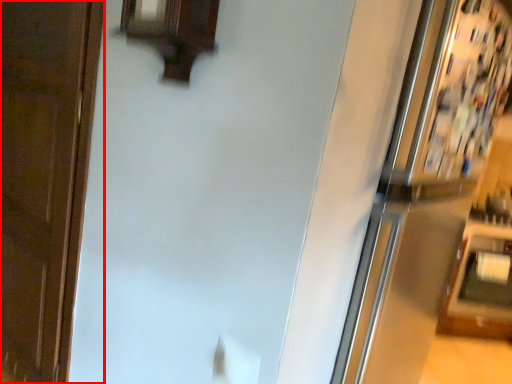
Question: From the image, what is the correct spatial relationship of door (annotated by the red box) in relation to fridge?

Choices:
 (A) left
 (B) right

Answer: (A)